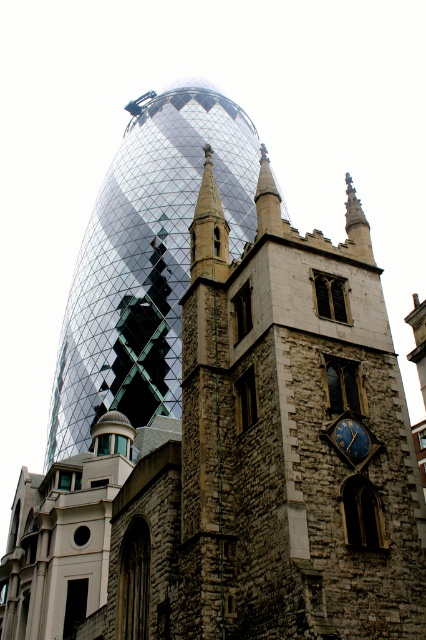
In the scene shown: Does stone spire at center have a lesser width compared to gold metallic clock at right?

In fact, stone spire at center might be wider than gold metallic clock at right.

Between point (209, 208) and point (342, 442), which one is positioned in front?

Point (342, 442) is more forward.

You are a GUI agent. You are given a task and a screenshot of the screen. Output one action in this format:
    pyautogui.click(x=<x>, y=<y>)
    Task: Click on the stone spire at center
    
    Given the screenshot: What is the action you would take?
    pyautogui.click(x=209, y=228)

Can you confirm if reflective glass tower at center is bigger than gold metallic clock at right?

Yes, reflective glass tower at center is bigger than gold metallic clock at right.

Does reflective glass tower at center have a smaller size compared to gold metallic clock at right?

No.

The height and width of the screenshot is (640, 426). What do you see at coordinates (146, 259) in the screenshot?
I see `reflective glass tower at center` at bounding box center [146, 259].

This screenshot has width=426, height=640. Find the location of `reflective glass tower at center`. reflective glass tower at center is located at coordinates (146, 259).

Does reflective glass tower at center lie behind stone spire at center?

Yes, it is behind stone spire at center.

This screenshot has height=640, width=426. What do you see at coordinates (146, 259) in the screenshot? I see `reflective glass tower at center` at bounding box center [146, 259].

Identify the location of reflective glass tower at center. The width and height of the screenshot is (426, 640). (146, 259).